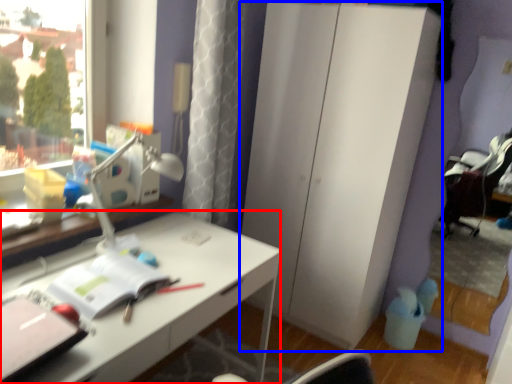
Question: Which object is further to the camera taking this photo, desk (highlighted by a red box) or dresser (highlighted by a blue box)?

Choices:
 (A) desk
 (B) dresser

Answer: (B)